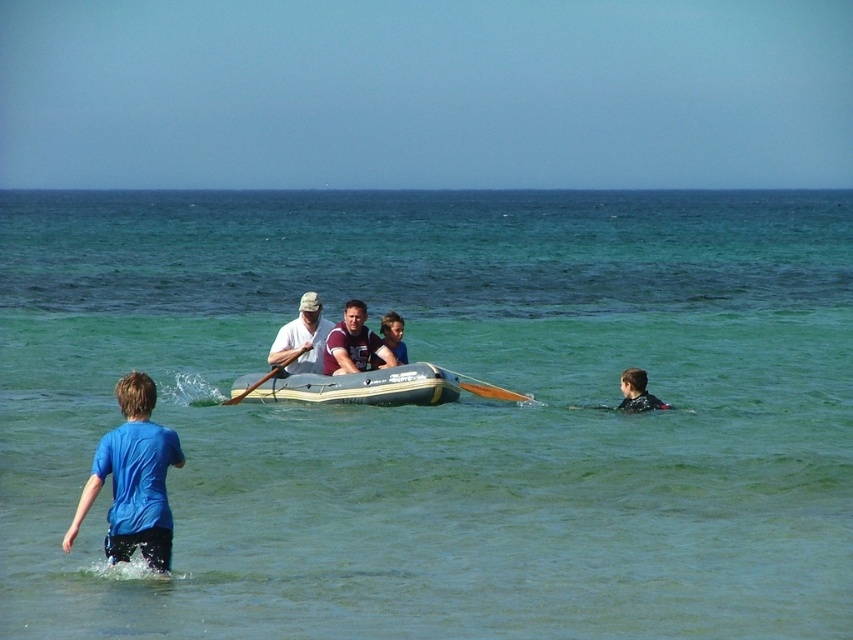
Question: Estimate the real-world distances between objects in this image. Which object is farther from the matte brown shirt at center?

Choices:
 (A) orange wood paddle at center
 (B) white matte life jacket at center
 (C) clear water at center

Answer: (C)

Question: From the image, what is the correct spatial relationship of matte brown shirt at center in relation to white matte life jacket at center?

Choices:
 (A) right
 (B) left

Answer: (A)

Question: Which point is closer to the camera?

Choices:
 (A) (456, 396)
 (B) (167, 545)

Answer: (B)

Question: Can you confirm if inflatable gray boat at center is thinner than white matte life jacket at center?

Choices:
 (A) no
 (B) yes

Answer: (A)

Question: Is clear water at center above inflatable gray boat at center?

Choices:
 (A) no
 (B) yes

Answer: (B)

Question: Which of these objects is positioned farthest from the maroon fabric shirt at center?

Choices:
 (A) blue cotton shirt at lower left
 (B) matte brown shirt at center

Answer: (A)